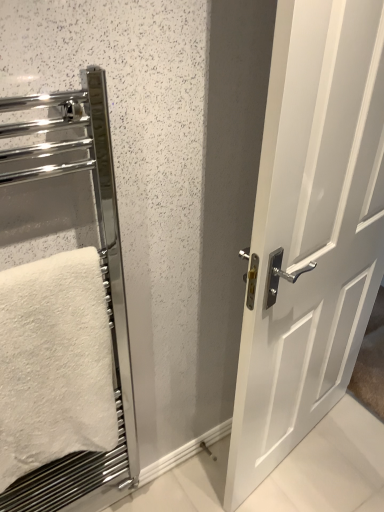
Question: Does white glossy door at center have a larger size compared to chrome metallic towel rack at left?

Choices:
 (A) no
 (B) yes

Answer: (B)

Question: Are white glossy door at center and chrome metallic towel rack at left located far from each other?

Choices:
 (A) yes
 (B) no

Answer: (B)

Question: Considering the relative positions of white glossy door at center and chrome metallic towel rack at left in the image provided, is white glossy door at center to the right of chrome metallic towel rack at left from the viewer's perspective?

Choices:
 (A) yes
 (B) no

Answer: (A)

Question: From the image's perspective, is white glossy door at center under chrome metallic towel rack at left?

Choices:
 (A) no
 (B) yes

Answer: (A)

Question: Does white glossy door at center turn towards chrome metallic towel rack at left?

Choices:
 (A) yes
 (B) no

Answer: (B)

Question: Based on their positions, is chrome metallic towel rack at left located to the left or right of white glossy door at center?

Choices:
 (A) left
 (B) right

Answer: (A)

Question: Relative to white glossy door at center, is chrome metallic towel rack at left in front or behind?

Choices:
 (A) front
 (B) behind

Answer: (A)

Question: Considering the positions of chrome metallic towel rack at left and white glossy door at center in the image, is chrome metallic towel rack at left wider or thinner than white glossy door at center?

Choices:
 (A) thin
 (B) wide

Answer: (A)

Question: Do you think chrome metallic towel rack at left is within white glossy door at center, or outside of it?

Choices:
 (A) outside
 (B) inside

Answer: (A)

Question: Is white fluffy towel at left wider or thinner than white glossy door at center?

Choices:
 (A) thin
 (B) wide

Answer: (B)

Question: Is white fluffy towel at left to the left or to the right of white glossy door at center in the image?

Choices:
 (A) left
 (B) right

Answer: (A)

Question: Is white fluffy towel at left taller or shorter than white glossy door at center?

Choices:
 (A) tall
 (B) short

Answer: (B)

Question: Would you say white fluffy towel at left is inside or outside white glossy door at center?

Choices:
 (A) outside
 (B) inside

Answer: (A)

Question: Looking at the image, does chrome metallic towel rack at left seem bigger or smaller compared to white fluffy towel at left?

Choices:
 (A) small
 (B) big

Answer: (B)

Question: From the image's perspective, is chrome metallic towel rack at left positioned above or below white fluffy towel at left?

Choices:
 (A) below
 (B) above

Answer: (B)